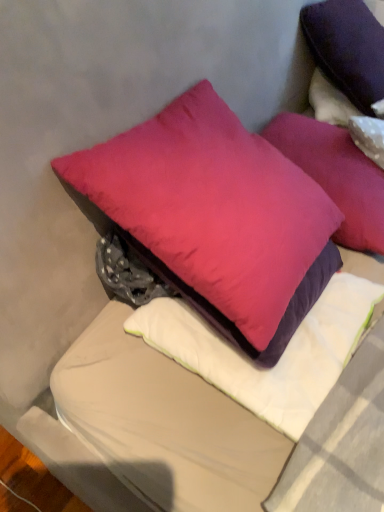
Question: In terms of height, does purple matte pillow at upper right, placed as the 4th pillow when sorted from bottom to top, look taller or shorter compared to satin purple pillow at center, arranged as the 1th pillow when ordered from the bottom?

Choices:
 (A) tall
 (B) short

Answer: (A)

Question: In the image, is purple matte pillow at upper right, the second pillow from the top, on the left side or the right side of satin purple pillow at center, arranged as the 1th pillow when ordered from the bottom?

Choices:
 (A) right
 (B) left

Answer: (A)

Question: Estimate the real-world distances between objects in this image. Which object is closer to the matte pink pillow at center, which is the 3th pillow from top to bottom?

Choices:
 (A) matte pink pillow at center, positioned as the 4th pillow in top-to-bottom order
 (B) purple velvet pillow at upper right, placed as the first pillow when sorted from top to bottom
 (C) purple matte pillow at upper right, placed as the 4th pillow when sorted from bottom to top
 (D) satin purple pillow at center, arranged as the 1th pillow when ordered from the bottom

Answer: (C)

Question: Estimate the real-world distances between objects in this image. Which object is farther from the matte pink pillow at center, marked as the third pillow in a bottom-to-top arrangement?

Choices:
 (A) satin purple pillow at center, the 5th pillow when ordered from top to bottom
 (B) purple matte pillow at upper right, placed as the 4th pillow when sorted from bottom to top
 (C) matte pink pillow at center, positioned as the 4th pillow in top-to-bottom order
 (D) purple velvet pillow at upper right, placed as the first pillow when sorted from top to bottom

Answer: (D)